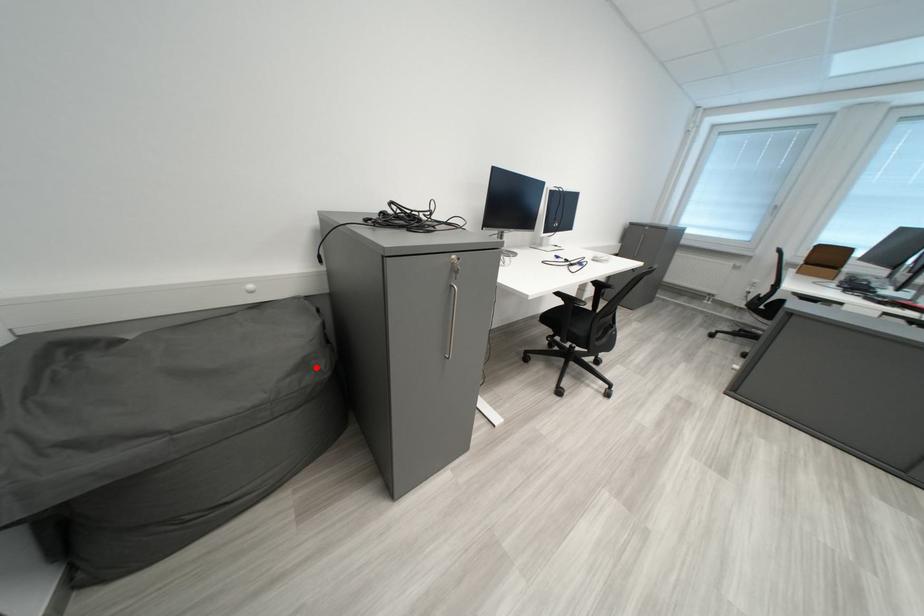
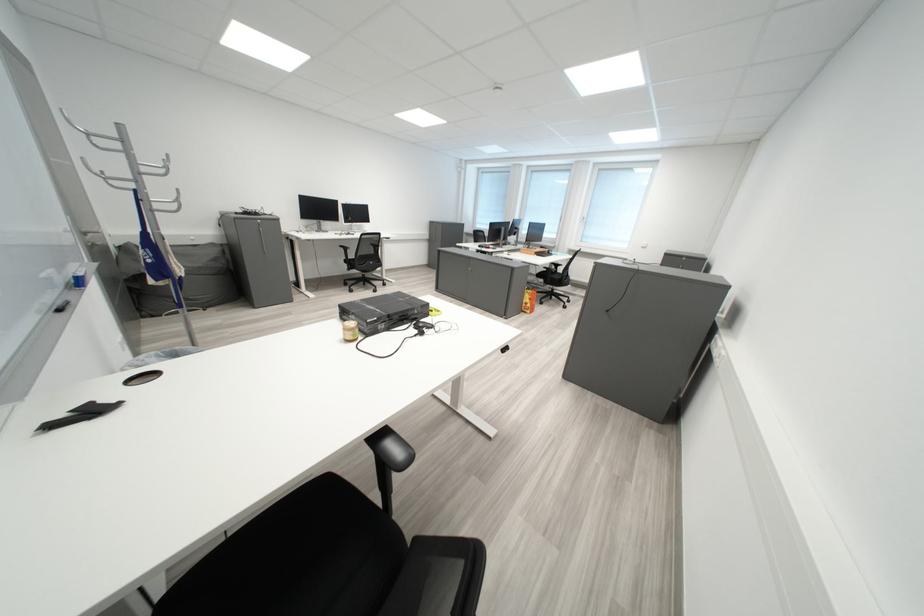
Question: I am providing you with two images of the same scene from different viewpoints. In image1, a red point is highlighted. Considering the same 3D point in image2, which of the following is correct?

Choices:
 (A) It is closer
 (B) It is farther

Answer: (A)